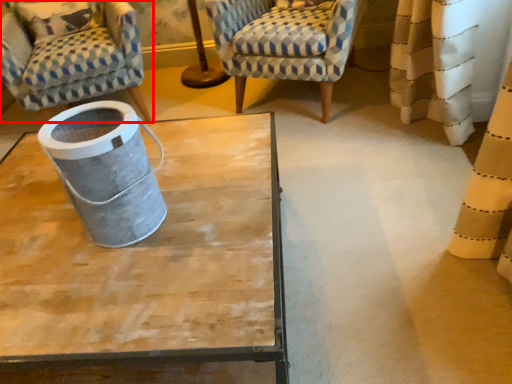
Question: In this image, where is chair (annotated by the red box) located relative to chair?

Choices:
 (A) left
 (B) right

Answer: (A)